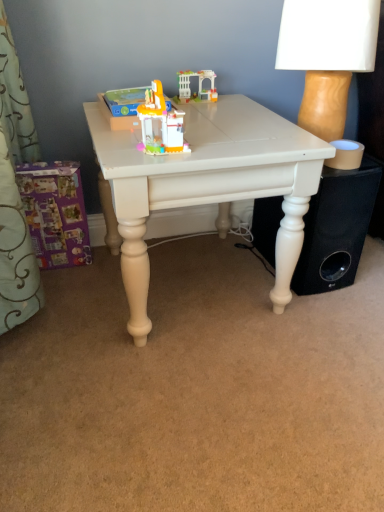
Image resolution: width=384 pixels, height=512 pixels. Find the location of `free point in front of black matte speaker at lower right`. free point in front of black matte speaker at lower right is located at coordinates (320, 315).